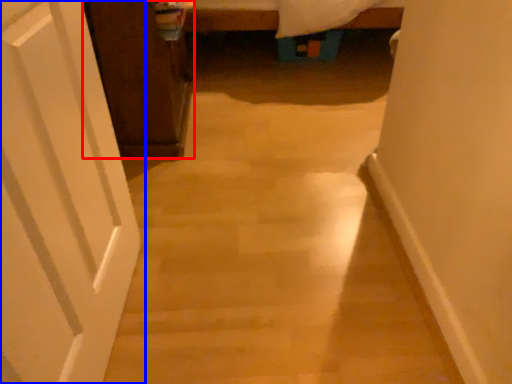
Question: Which of the following is the farthest to the observer, cabinetry (highlighted by a red box) or door (highlighted by a blue box)?

Choices:
 (A) cabinetry
 (B) door

Answer: (A)